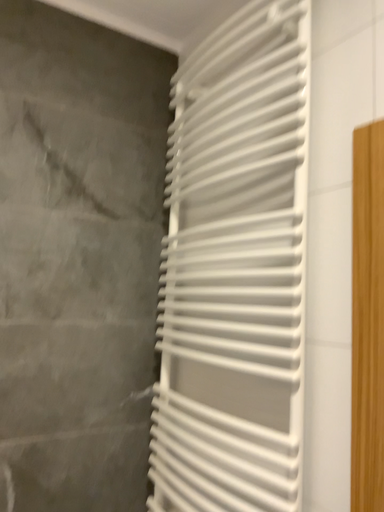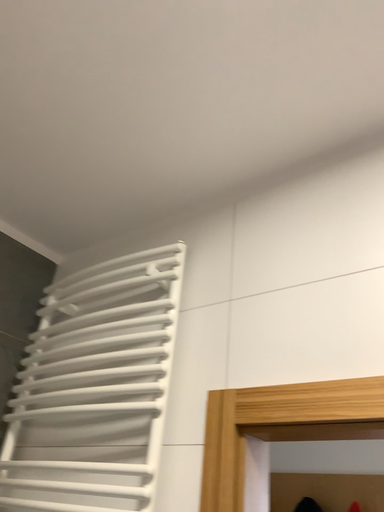
Question: How did the camera likely rotate when shooting the video?

Choices:
 (A) rotated upward
 (B) rotated downward

Answer: (A)